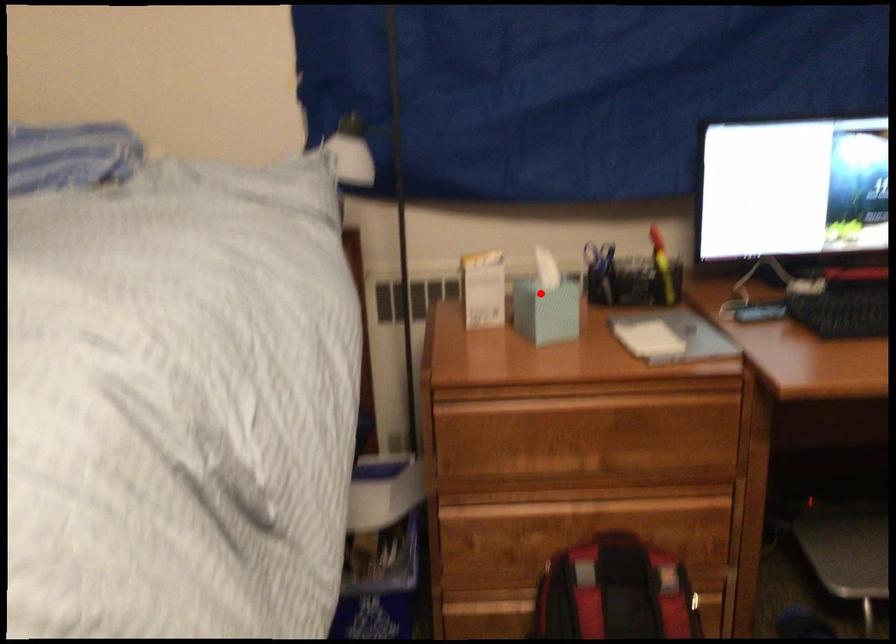
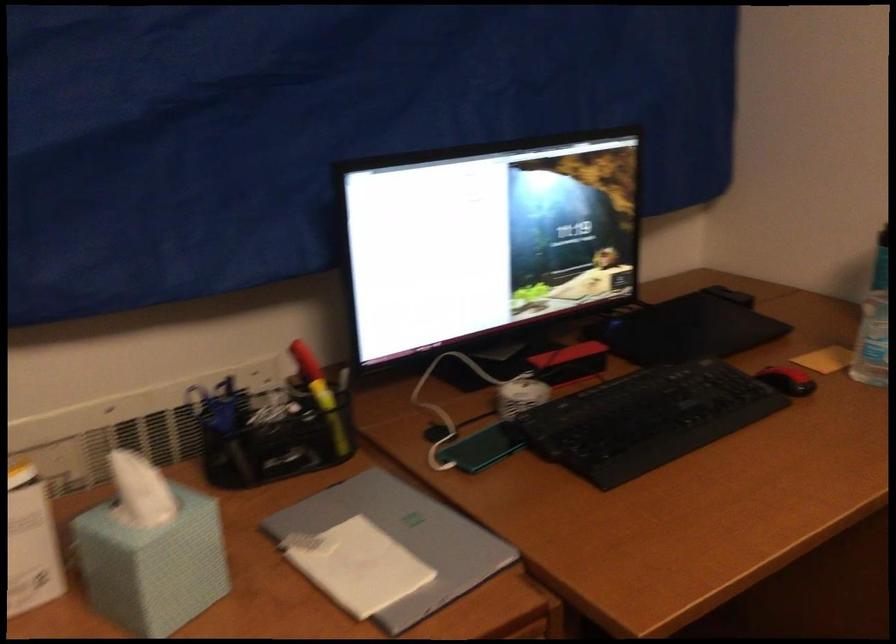
Find the pixel in the second image that matches the highlighted location in the first image.

(150, 550)